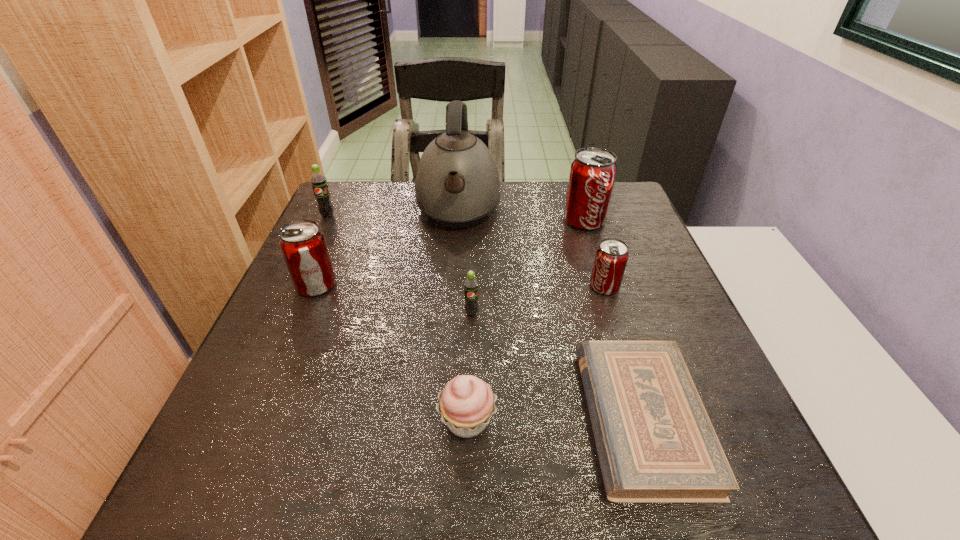
You are a GUI agent. You are given a task and a screenshot of the screen. Output one action in this format:
    pyautogui.click(x=<x>, y=<y>)
    Task: Click on the vacant space that is in between the kettle and the pink cupcake
    Image resolution: width=960 pixels, height=540 pixels.
    Given the screenshot: What is the action you would take?
    pyautogui.click(x=463, y=316)

At what (x,y) coordinates should I click in order to perform the action: click on free spot between the right green soda and the smallest red pop soda. Please return your answer as a coordinate pair (x, y). Looking at the image, I should click on (539, 300).

This screenshot has width=960, height=540. Find the location of `free space between the nearest soda and the farthest red pop soda`. free space between the nearest soda and the farthest red pop soda is located at coordinates (528, 267).

The width and height of the screenshot is (960, 540). In order to click on free spot between the seventh shortest object and the Bible in this screenshot , I will do [x=612, y=320].

What are the coordinates of `vacant space that's between the blue Bible and the tallest object` in the screenshot? It's located at (550, 315).

Choose which object is the nearest neighbor to the bigger green soda. Please provide its 2D coordinates. Your answer should be formatted as a tuple, i.e. [(x, y)], where the tuple contains the x and y coordinates of a point satisfying the conditions above.

[(303, 245)]

I want to click on object that is the fifth closest to the kettle, so [x=611, y=257].

At what (x,y) coordinates should I click in order to perform the action: click on soda that can be found as the closest to the blue Bible. Please return your answer as a coordinate pair (x, y). This screenshot has width=960, height=540. Looking at the image, I should click on click(x=611, y=257).

I want to click on soda that is the fifth nearest to the cupcake, so click(x=319, y=182).

The width and height of the screenshot is (960, 540). Identify the location of the closest red pop soda to the farther green soda. (303, 245).